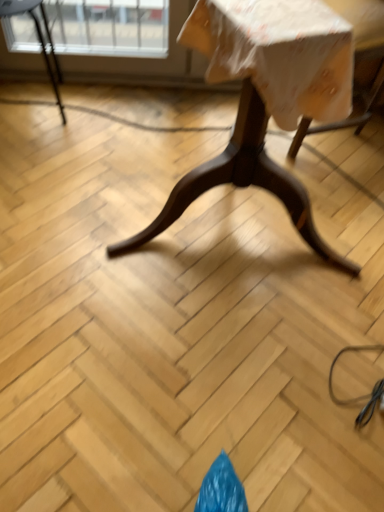
Question: Considering the positions of point (218, 73) and point (369, 39), is point (218, 73) closer or farther from the camera than point (369, 39)?

Choices:
 (A) farther
 (B) closer

Answer: (B)

Question: From a real-world perspective, relative to wooden swivel chair at upper right, is wooden table at center vertically above or below?

Choices:
 (A) above
 (B) below

Answer: (A)

Question: Which object is the closest to the metallic black chair at upper left?

Choices:
 (A) wooden table at center
 (B) wooden swivel chair at upper right

Answer: (B)

Question: Estimate the real-world distances between objects in this image. Which object is closer to the wooden swivel chair at upper right?

Choices:
 (A) wooden table at center
 (B) metallic black chair at upper left

Answer: (A)